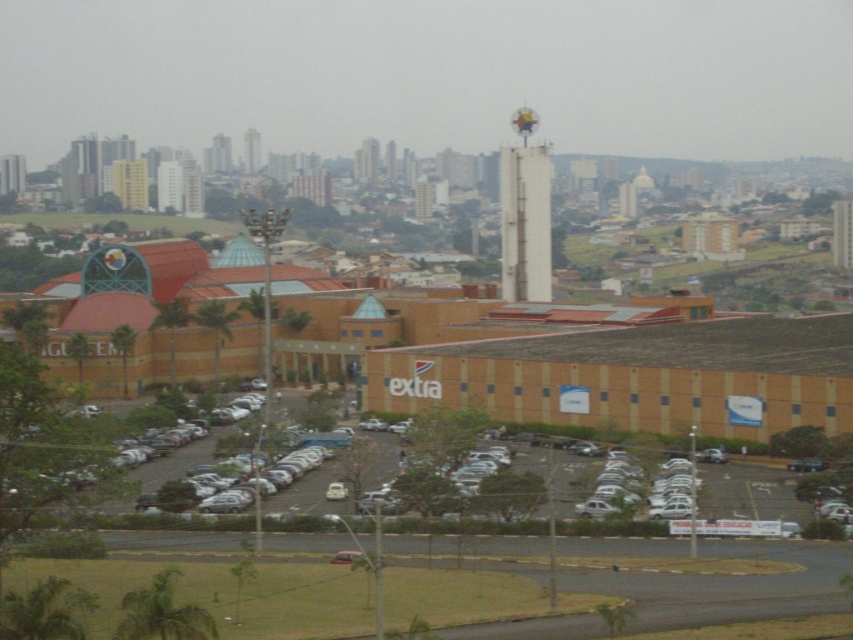
Is white concrete bell tower at center to the right of white concrete tower at upper center from the viewer's perspective?

Correct, you'll find white concrete bell tower at center to the right of white concrete tower at upper center.

This screenshot has width=853, height=640. What do you see at coordinates (525, 216) in the screenshot?
I see `white concrete bell tower at center` at bounding box center [525, 216].

Is point (537, 291) positioned after point (258, 168)?

That is False.

Locate an element on the screen. white concrete bell tower at center is located at coordinates (525, 216).